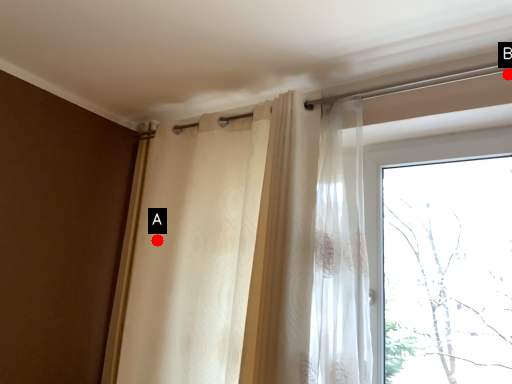
Question: Two points are circled on the image, labeled by A and B beside each circle. Which point appears closest to the camera in this image?

Choices:
 (A) A is closer
 (B) B is closer

Answer: (B)